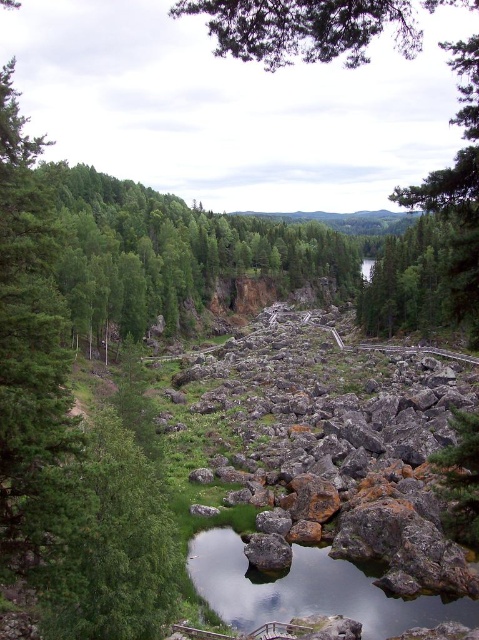
Question: Which of the following is the closest to the observer?

Choices:
 (A) pos(477,144)
 (B) pos(254,424)
 (C) pos(330,611)

Answer: (A)

Question: Can you confirm if green leafy tree at center is bigger than clear water at center?

Choices:
 (A) yes
 (B) no

Answer: (A)

Question: Which point is closer to the camera?

Choices:
 (A) rusty metallic rocks at center
 (B) clear water at center

Answer: (A)

Question: Does rusty metallic rocks at center come behind green leafy tree at center?

Choices:
 (A) no
 (B) yes

Answer: (B)

Question: Which point is closer to the camera?

Choices:
 (A) (392, 602)
 (B) (354, 506)

Answer: (A)

Question: Can you confirm if rusty metallic rocks at center is positioned to the right of green leafy tree at center?

Choices:
 (A) yes
 (B) no

Answer: (A)